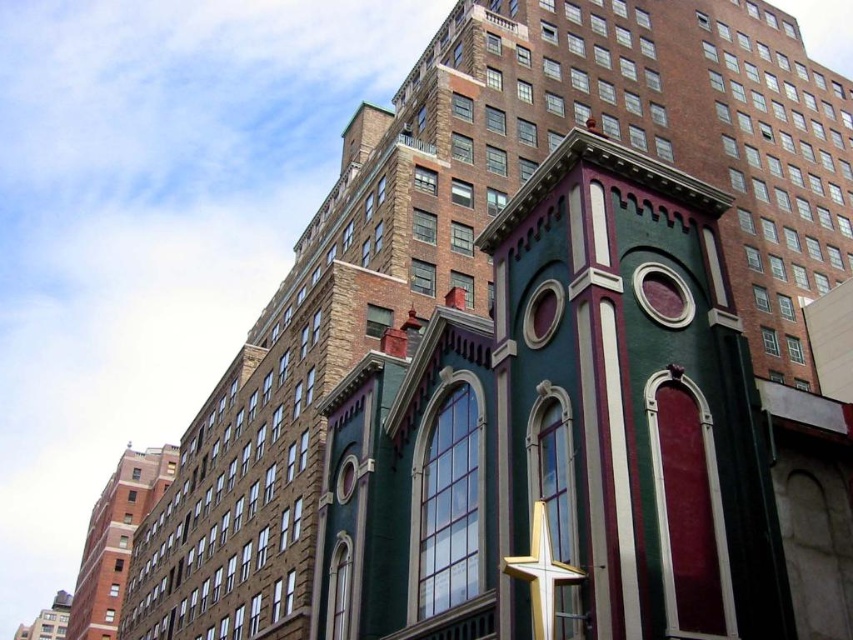
You are an architect analyzing the image. You need to determine if the gold metallic star at center can be seen above the green painted brick church at lower left from a distance. Based on their heights, what is your conclusion?

The green painted brick church at lower left is taller than the gold metallic star at center, so the star cannot be seen above the church from a distance.

You are an architect planning to install a new light on the gold metallic star at center. The light requires a pole that must be 1.2 meters taller than the star itself. Considering the height of the green matte church at lower left, will the pole potentially interfere with the church?

The gold metallic star at center is shorter than the green matte church at lower left. Since the pole needs to be 1.2 meters taller than the star, but the church is already taller than the star, the pole might not interfere as long as it is placed appropriately. However, exact measurements are needed for confirmation.